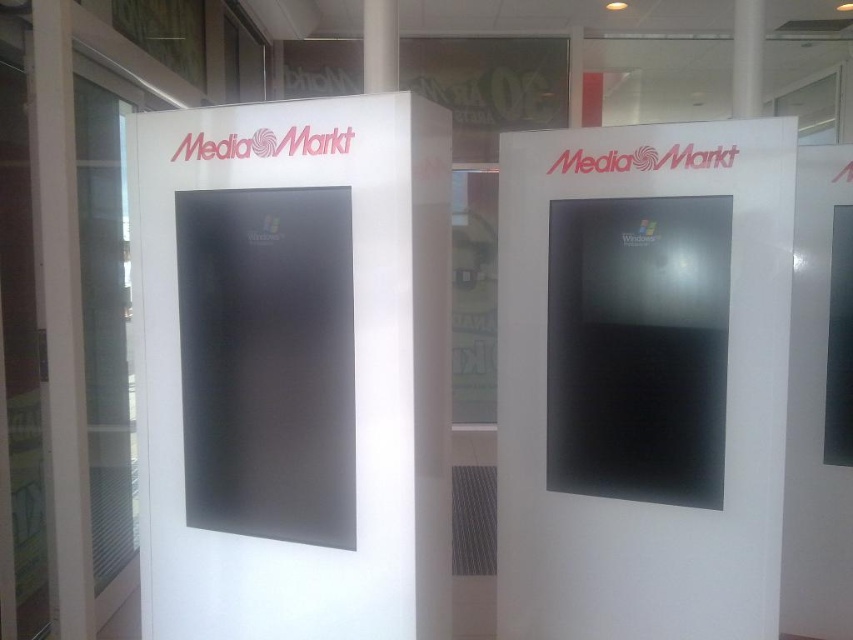
Question: Does satin black monitor at center have a greater width compared to white glossy display at center?

Choices:
 (A) no
 (B) yes

Answer: (B)

Question: Does satin black monitor at center appear over white glossy pillar at left?

Choices:
 (A) yes
 (B) no

Answer: (B)

Question: Which is farther from the white matte pillar at center?

Choices:
 (A) white glossy display at center
 (B) white glossy pillar at left
 (C) satin black monitor at center

Answer: (C)

Question: Which of the following is the closest to the observer?

Choices:
 (A) (39, 195)
 (B) (433, 275)
 (C) (386, 10)

Answer: (B)

Question: Which of these objects is positioned closest to the white glossy pillar at left?

Choices:
 (A) white glossy display at center
 (B) satin black monitor at center
 (C) white matte pillar at center

Answer: (B)

Question: Does satin black monitor at center appear under white matte pillar at center?

Choices:
 (A) no
 (B) yes

Answer: (B)